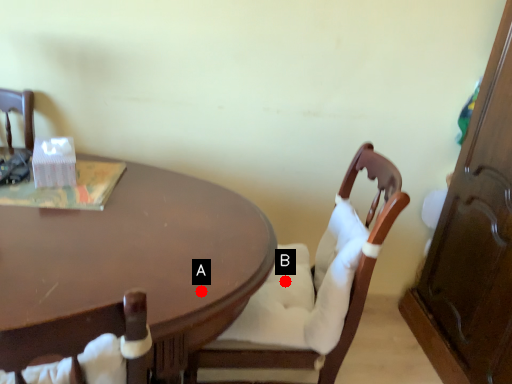
Question: Two points are circled on the image, labeled by A and B beside each circle. Which point is further to the camera?

Choices:
 (A) A is further
 (B) B is further

Answer: (B)